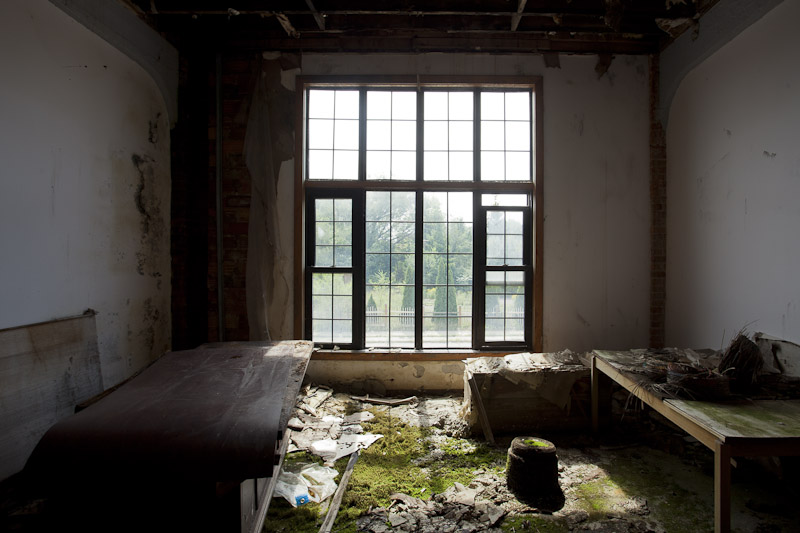
I want to click on table, so click(201, 411).